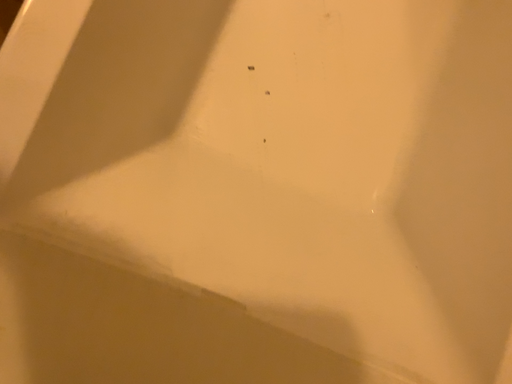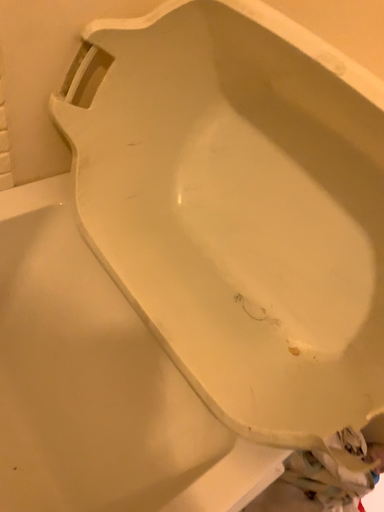
Question: How did the camera likely rotate when shooting the video?

Choices:
 (A) rotated upward
 (B) rotated downward

Answer: (A)